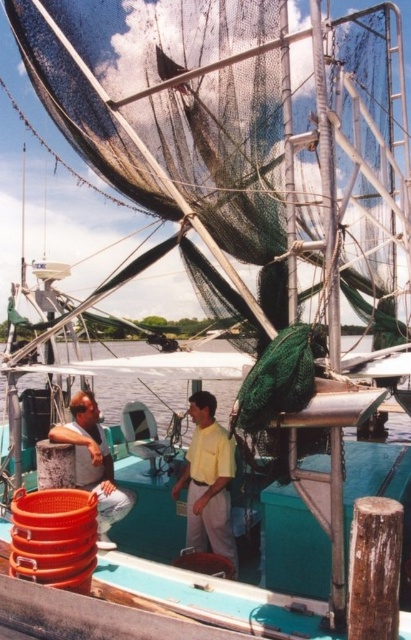
You are a photographer trying to capture a closeup of the yellow matte shirt at center and the green net at lower center. Which object should you zoom in on to ensure both are in the frame without moving the camera?

You should zoom in on the yellow matte shirt at center because it is smaller than the green net at lower center, allowing both to fit within the frame when focusing on the smaller object.

You are a sailor on the fishing boat and need to store a tall fishing rod. Which object, the green net at lower center or the matte orange bucket at lower left, would be a better choice for storing it based on their heights?

The green net at lower center has a greater height compared to the matte orange bucket at lower left, so it would be a better choice for storing the tall fishing rod.